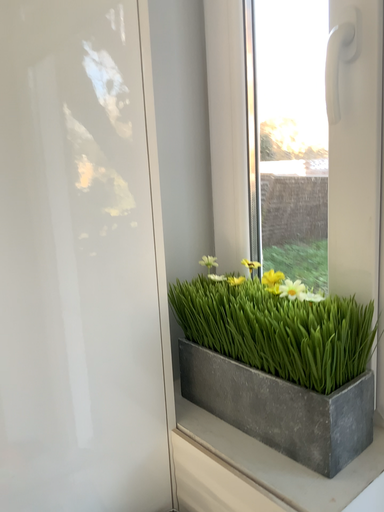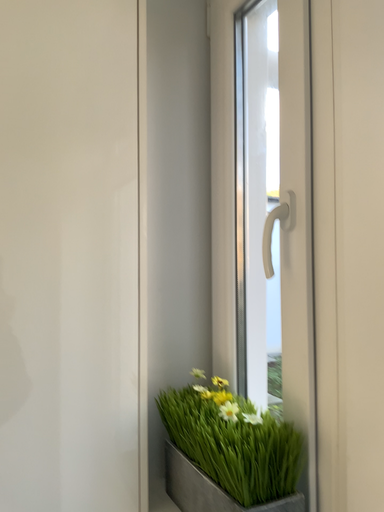
Question: Which way did the camera rotate in the video?

Choices:
 (A) rotated downward
 (B) rotated upward

Answer: (B)